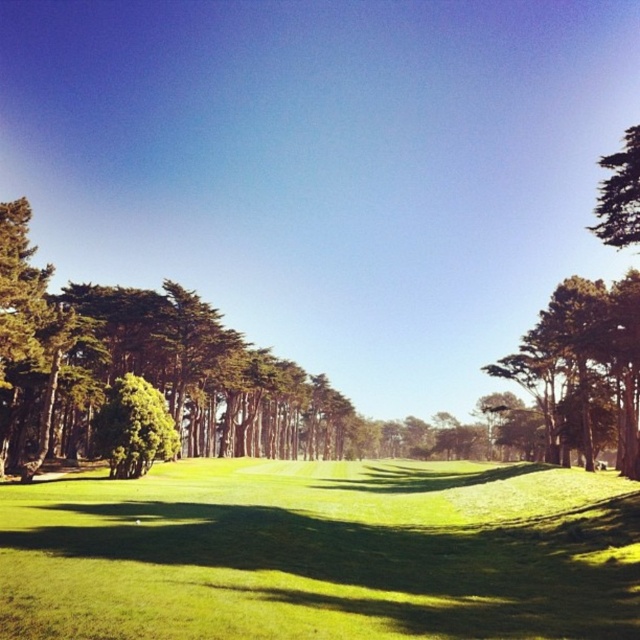
You are standing at point [323,552] on the golf course. What is the color of the ground beneath your feet?

The ground beneath your feet at point [323,552] is green grass at center.

You are a golfer standing at the tee box and want to hit a ball to the hole. The green leafy tree at left and the green leafy tree at upper right are in your line of sight. How far apart are these two trees?

The green leafy tree at left is 89.36 meters away from the green leafy tree at upper right.